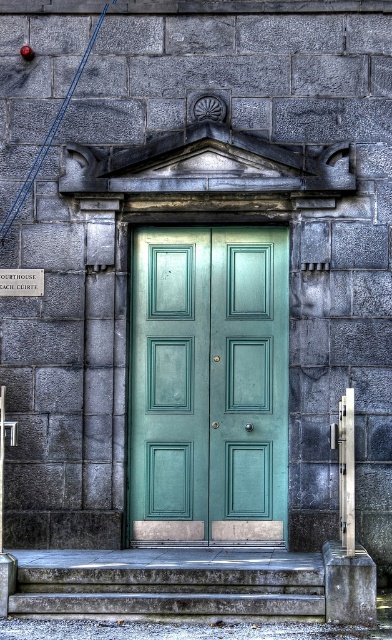
Question: Can you confirm if teal glossy door at center is positioned below smooth concrete stairs at center?

Choices:
 (A) no
 (B) yes

Answer: (A)

Question: Which point is farther to the camera?

Choices:
 (A) teal glossy door at center
 (B) smooth concrete stairs at center

Answer: (A)

Question: Which point is closer to the camera?

Choices:
 (A) (313, 595)
 (B) (181, 449)

Answer: (A)

Question: Can you confirm if teal glossy door at center is smaller than smooth concrete stairs at center?

Choices:
 (A) yes
 (B) no

Answer: (A)

Question: Is teal glossy door at center behind smooth concrete stairs at center?

Choices:
 (A) yes
 (B) no

Answer: (A)